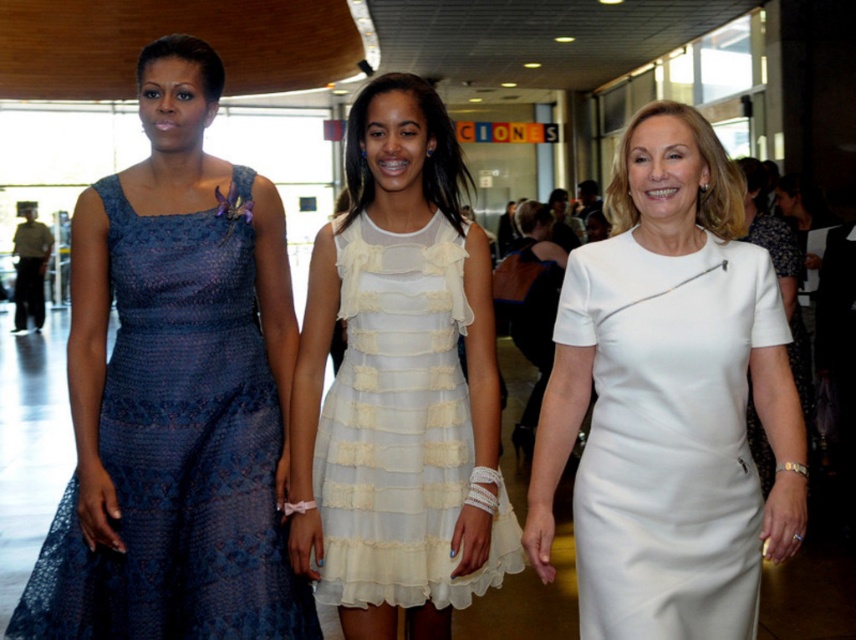
You are a photographer adjusting your camera settings to focus on two specific points in the image. The first point is at coordinate point(729, 451) and the second is at point(143, 552). Which point should you focus on first if you want to ensure the closest object is in sharp focus?

You should focus on point(729, 451) first because it is closer to the camera than point(143, 552), ensuring the closest object is sharply focused.

You are standing in the hall and want to take a photo of the point at coordinates point (387, 538). Your camera has a focal length of 50mm and a sensor size of 24mm. What is the approximate distance in meters between you and the point?

The distance between you and the point is approximately 2.39 meters.